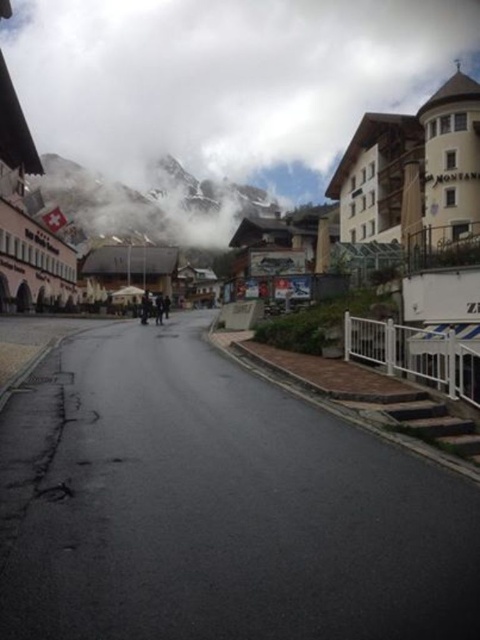
Question: Which of these objects is positioned closest to the snowy rocky mountain at upper center?

Choices:
 (A) white fluffy cloud at upper center
 (B) dark gray fabric jacket at center

Answer: (A)

Question: Can you confirm if white fluffy cloud at upper center is smaller than dark gray fabric jacket at center?

Choices:
 (A) no
 (B) yes

Answer: (A)

Question: Observing the image, what is the correct spatial positioning of white fluffy cloud at upper center in reference to dark gray fabric jacket at center?

Choices:
 (A) left
 (B) right

Answer: (B)

Question: Can you confirm if white fluffy cloud at upper center is positioned below snowy rocky mountain at upper center?

Choices:
 (A) yes
 (B) no

Answer: (B)

Question: Which object is closer to the camera taking this photo?

Choices:
 (A) dark gray fabric jacket at center
 (B) snowy rocky mountain at upper center

Answer: (A)

Question: Which object is positioned closest to the white fluffy cloud at upper center?

Choices:
 (A) snowy rocky mountain at upper center
 (B) dark gray fabric jacket at center

Answer: (A)